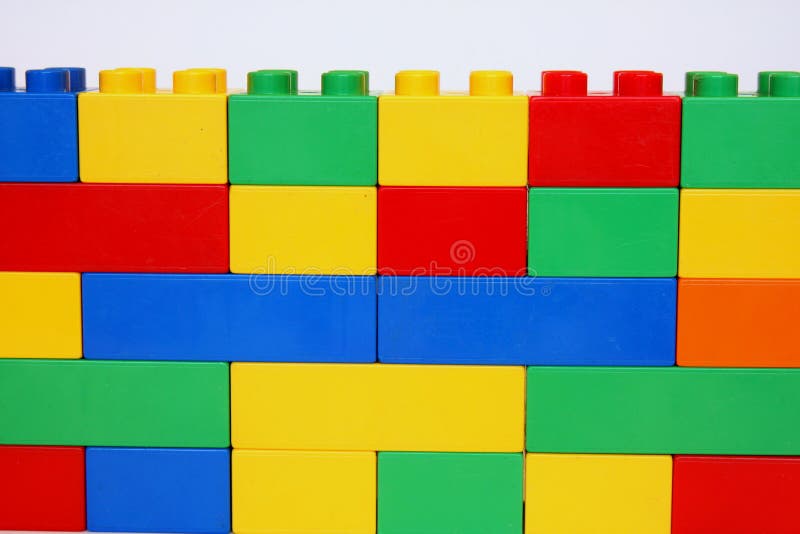
In order to click on yellow lego toy blocks in this screenshot , I will do `click(154, 121)`, `click(306, 216)`, `click(454, 136)`, `click(742, 226)`, `click(41, 304)`, `click(310, 404)`, `click(312, 488)`, `click(573, 498)`.